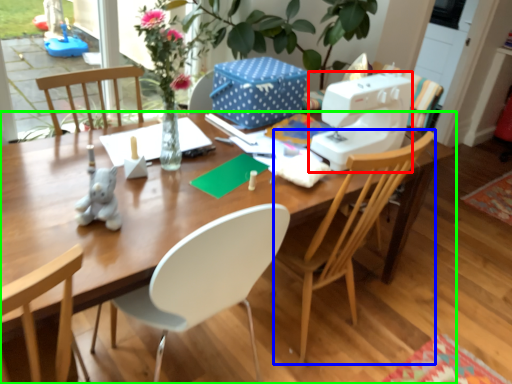
Question: Estimate the real-world distances between objects in this image. Which object is closer to sewing machine (highlighted by a red box), chair (highlighted by a blue box) or desk (highlighted by a green box)?

Choices:
 (A) chair
 (B) desk

Answer: (A)